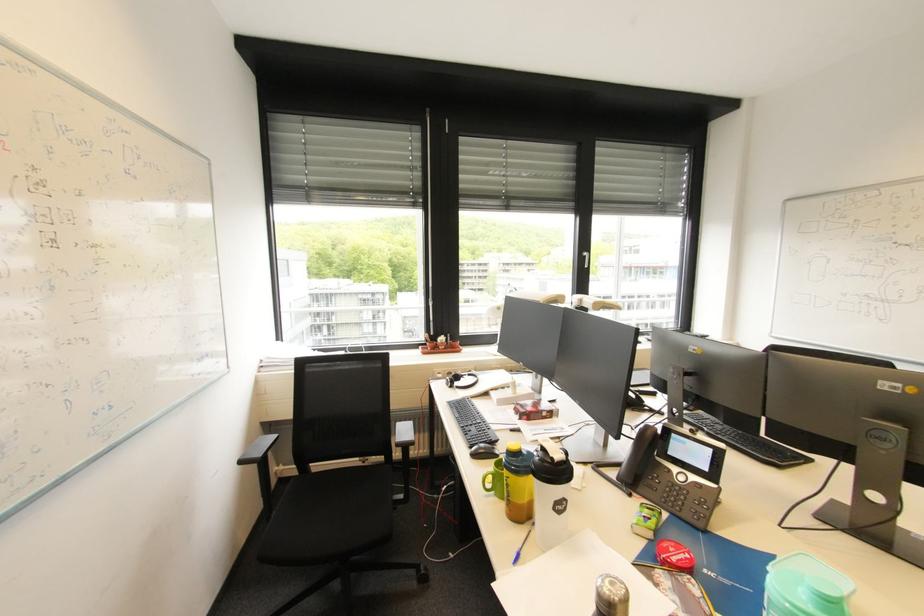
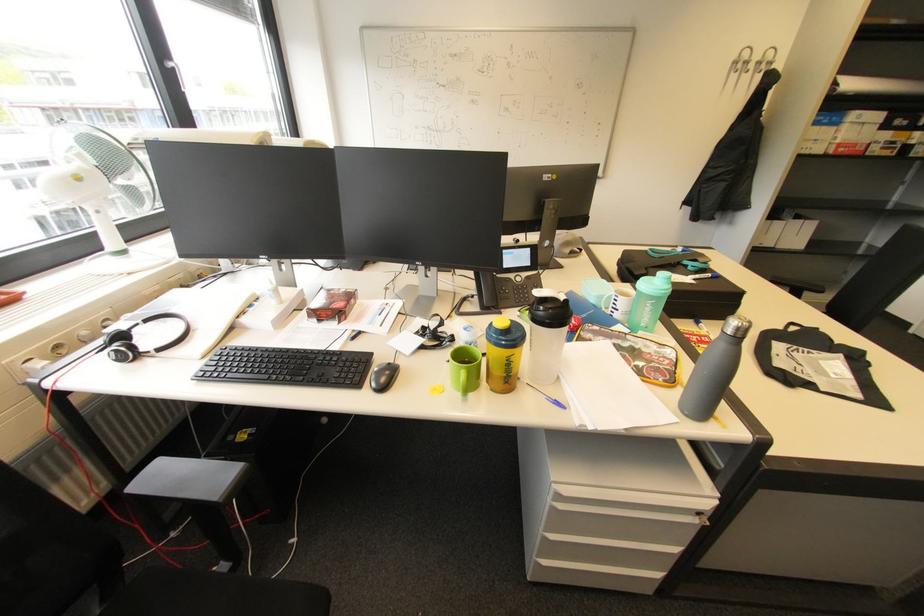
Where in the second image is the point corresponding to point 480,456 from the first image?

(387, 389)